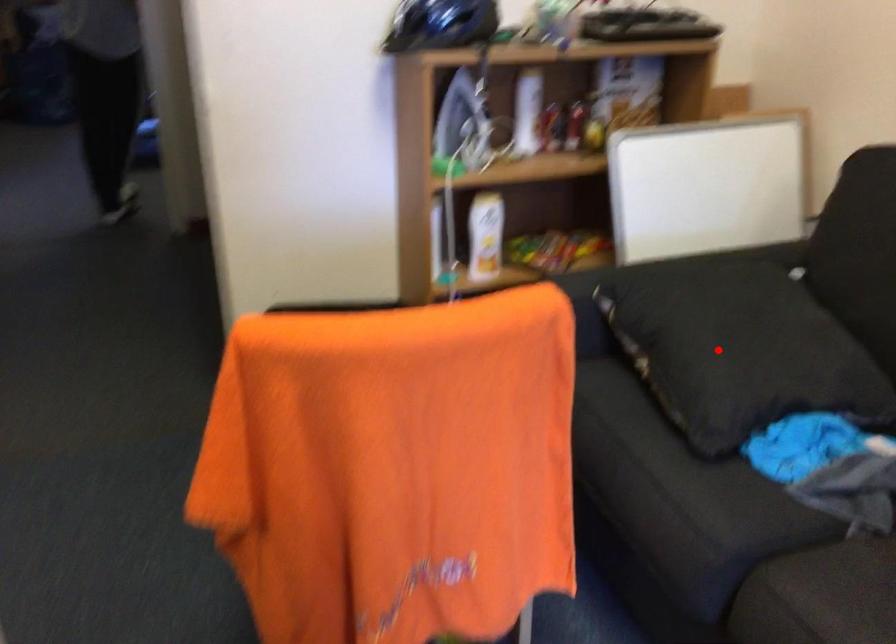
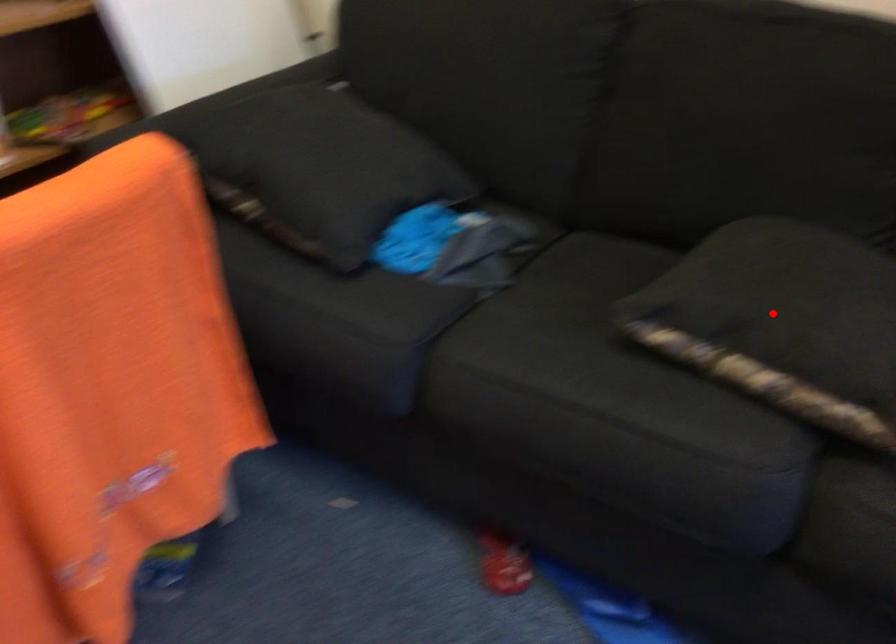
I am providing you with two images of the same scene from different viewpoints. A red point is marked on the first image and another point is marked on the second image. Does the point marked in image1 correspond to the same location as the one in image2?

No